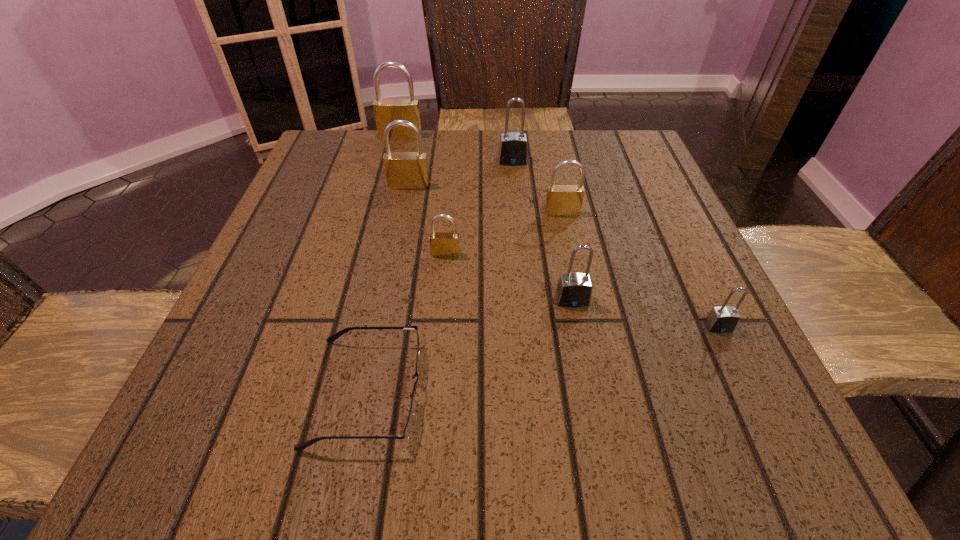
Identify the location of the biggest brass padlock. The image size is (960, 540). (386, 111).

Locate an element on the screen. This screenshot has height=540, width=960. the tallest padlock is located at coordinates (386, 111).

Where is `the fourth object from right to left`? The height and width of the screenshot is (540, 960). the fourth object from right to left is located at coordinates (513, 149).

Where is `the leftmost gray padlock`? The width and height of the screenshot is (960, 540). the leftmost gray padlock is located at coordinates (513, 149).

What are the coordinates of `the second biggest brass padlock` in the screenshot? It's located at (404, 170).

Identify the location of the third nearest brass padlock. (404, 170).

The image size is (960, 540). I want to click on the third nearest object, so click(x=574, y=290).

Image resolution: width=960 pixels, height=540 pixels. Identify the location of the sixth farthest padlock. (574, 290).

Where is `the third biggest brass padlock`? This screenshot has width=960, height=540. the third biggest brass padlock is located at coordinates 561,200.

Locate an element on the screen. The image size is (960, 540). the rightmost brass padlock is located at coordinates (561, 200).